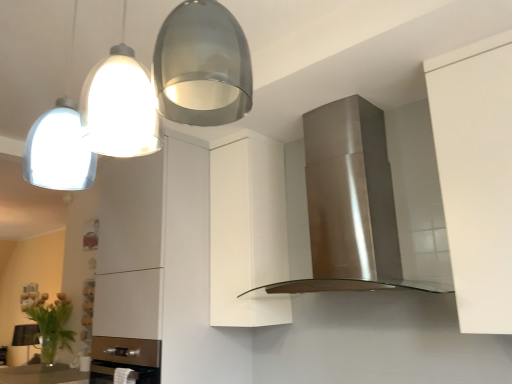
Question: Is green leafy plant at lower left thinner than white matte cabinet at center?

Choices:
 (A) yes
 (B) no

Answer: (B)

Question: Can you confirm if green leafy plant at lower left is wider than white matte cabinet at center?

Choices:
 (A) yes
 (B) no

Answer: (A)

Question: Is green leafy plant at lower left aimed at white matte cabinet at center?

Choices:
 (A) no
 (B) yes

Answer: (A)

Question: Is green leafy plant at lower left positioned beyond the bounds of white matte cabinet at center?

Choices:
 (A) no
 (B) yes

Answer: (B)

Question: From a real-world perspective, is green leafy plant at lower left below white matte cabinet at center?

Choices:
 (A) yes
 (B) no

Answer: (A)

Question: Considering their positions, is satin silver pendant lights at upper left located in front of or behind green leafy plant at lower left?

Choices:
 (A) front
 (B) behind

Answer: (A)

Question: Looking at the image, does satin silver pendant lights at upper left seem bigger or smaller compared to green leafy plant at lower left?

Choices:
 (A) small
 (B) big

Answer: (B)

Question: From the image's perspective, relative to green leafy plant at lower left, is satin silver pendant lights at upper left above or below?

Choices:
 (A) below
 (B) above

Answer: (B)

Question: In terms of height, does satin silver pendant lights at upper left look taller or shorter compared to green leafy plant at lower left?

Choices:
 (A) tall
 (B) short

Answer: (A)

Question: Is satin silver pendant lights at upper left taller or shorter than white matte cabinet at center?

Choices:
 (A) tall
 (B) short

Answer: (B)

Question: Does point (198, 67) appear closer or farther from the camera than point (229, 175)?

Choices:
 (A) closer
 (B) farther

Answer: (A)

Question: Is satin silver pendant lights at upper left wider or thinner than white matte cabinet at center?

Choices:
 (A) wide
 (B) thin

Answer: (A)

Question: Do you think satin silver pendant lights at upper left is within white matte cabinet at center, or outside of it?

Choices:
 (A) outside
 (B) inside

Answer: (A)

Question: Considering the positions of white matte cabinet at center and satin silver pendant lights at upper left in the image, is white matte cabinet at center wider or thinner than satin silver pendant lights at upper left?

Choices:
 (A) wide
 (B) thin

Answer: (B)

Question: Is point (217, 241) closer or farther from the camera than point (207, 104)?

Choices:
 (A) closer
 (B) farther

Answer: (B)